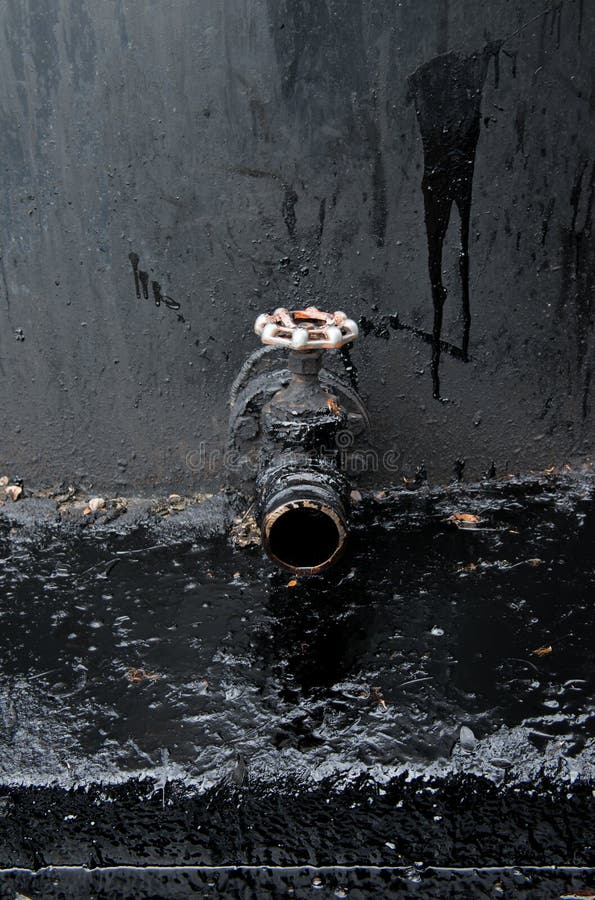
The width and height of the screenshot is (595, 900). Identify the location of paint stains on wall. (441, 111), (143, 284).